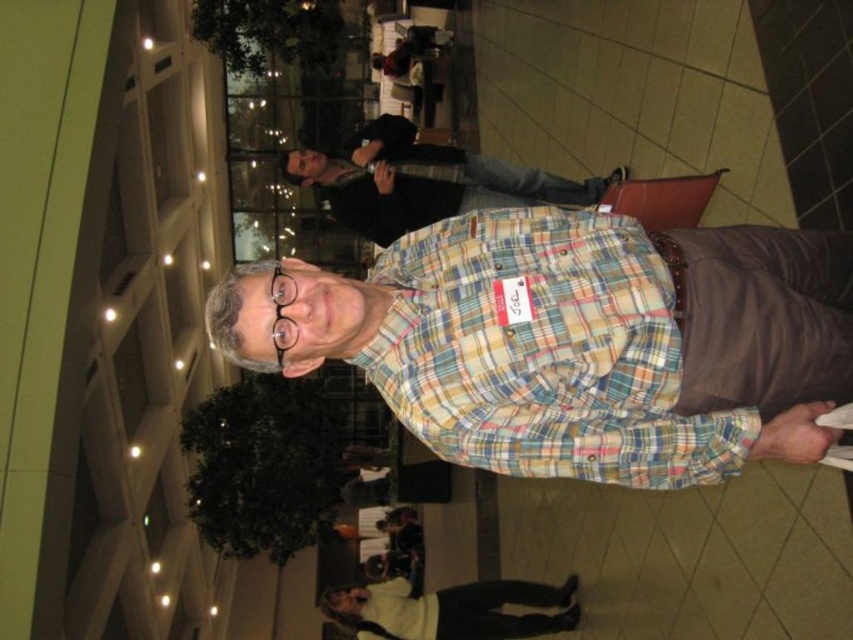
Does multicolored plaid shirt at center appear over white fleece sweater at lower center?

Yes, multicolored plaid shirt at center is above white fleece sweater at lower center.

Describe the element at coordinates (544, 352) in the screenshot. I see `multicolored plaid shirt at center` at that location.

Identify the location of multicolored plaid shirt at center. (544, 352).